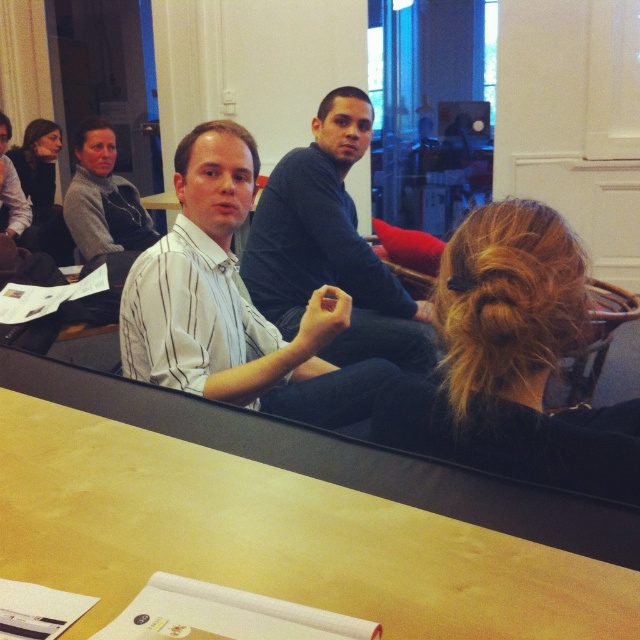
Question: Is blonde hair at center positioned at the back of white striped shirt at center?

Choices:
 (A) yes
 (B) no

Answer: (B)

Question: Can you confirm if gray sweater at upper left is wider than matte black hair at upper left?

Choices:
 (A) yes
 (B) no

Answer: (B)

Question: Which object is the farthest from the white striped shirt at center?

Choices:
 (A) blonde hair at center
 (B) gray sweater at upper left
 (C) matte black hair at upper left
 (D) white striped shirt at left

Answer: (D)

Question: Does blonde hair at center have a greater width compared to dark blue sweater at center?

Choices:
 (A) no
 (B) yes

Answer: (A)

Question: Which point is closer to the camera taking this photo?

Choices:
 (A) (243, 380)
 (B) (369, 316)
 (C) (92, 253)
 (D) (29, 177)

Answer: (A)

Question: Which point appears farthest from the camera in this image?

Choices:
 (A) pos(518,611)
 (B) pos(19,170)
 (C) pos(289,236)
 (D) pos(515,433)

Answer: (B)